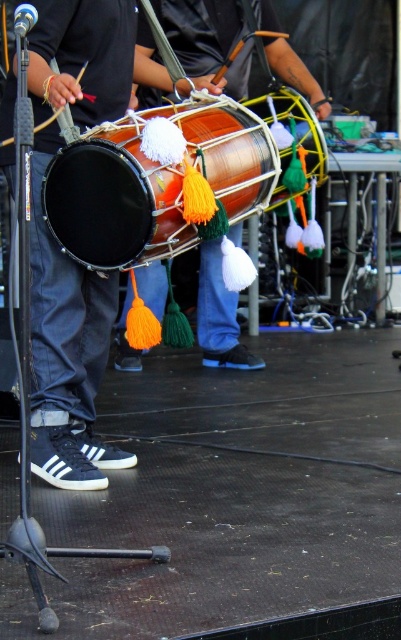
Can you confirm if matte copper drum at center is positioned to the right of shiny copper drum at center?

Result: No, matte copper drum at center is not to the right of shiny copper drum at center.

Where is `matte copper drum at center`? Image resolution: width=401 pixels, height=640 pixels. matte copper drum at center is located at coordinates (153, 182).

Which of these two, matte copper drum at center or matte orange drum at center, stands taller?

matte copper drum at center is taller.

Between matte copper drum at center and matte orange drum at center, which one is positioned lower?

Positioned lower is matte copper drum at center.

The image size is (401, 640). In order to click on matte copper drum at center in this screenshot , I will do `click(153, 182)`.

Where is `matte copper drum at center`? This screenshot has width=401, height=640. matte copper drum at center is located at coordinates (153, 182).

Who is positioned more to the right, matte black drum at left or shiny copper drum at center?

shiny copper drum at center is more to the right.

Is matte black drum at left thinner than shiny copper drum at center?

Incorrect, matte black drum at left's width is not less than shiny copper drum at center's.

Does point (64, 76) come in front of point (315, 115)?

Yes, point (64, 76) is in front of point (315, 115).

Locate an element on the screen. This screenshot has height=640, width=401. matte black drum at left is located at coordinates (66, 349).